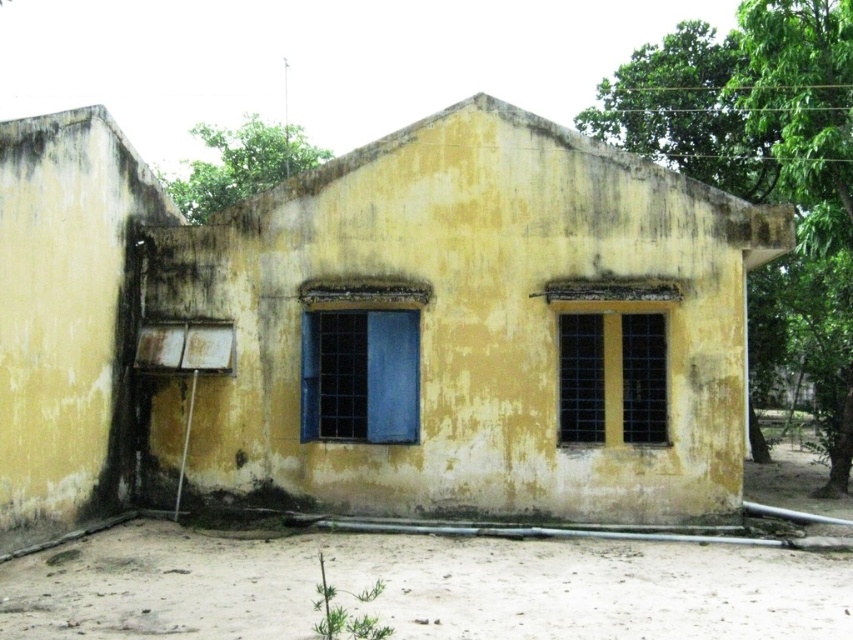
Looking at this image, you are a painter standing 3 meters away from the blue glass window at center. You need to paint the matte glass window at center right. Can you reach it with a 2.5 meter long pole?

The distance between the blue glass window at center and the matte glass window at center right is 2.18 meters. Since you are 3 meters away from the blue glass window, the total distance to the matte glass window would be 3 meters plus 2.18 meters, totaling 5.18 meters. The 2.5 meter pole is insufficient to reach that distance.

You are standing at point (375, 308). What is the color of the building directly in front of you?

The yellow matte building at center is directly in front of you at point (375, 308).

You are standing in front of the weathered building and want to locate two specific points marked on the wall. The first point is at coordinates point (x=776, y=627) and the second is at point (x=364, y=310). Which point is closer to you?

Point (x=776, y=627) is in front of point (x=364, y=310), so the first point is closer to you.